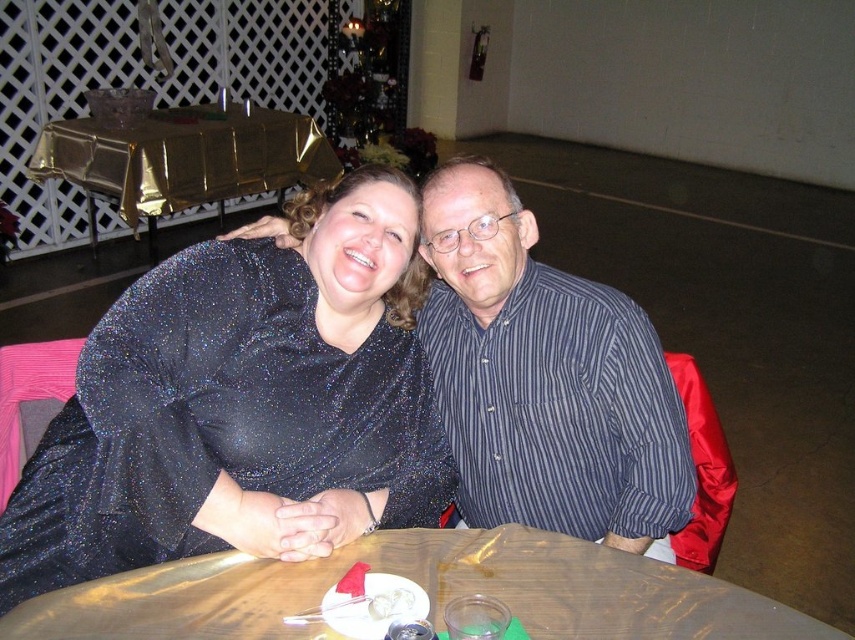
Question: Is gold plastic table at center behind white creamy dessert at table?

Choices:
 (A) yes
 (B) no

Answer: (B)

Question: Which is nearer to the white creamy dessert at table?

Choices:
 (A) gold foil table at upper left
 (B) sparkly black dress at center
 (C) gold plastic table at center
 (D) striped cotton shirt at center

Answer: (C)

Question: Is striped cotton shirt at center below gold plastic table at center?

Choices:
 (A) yes
 (B) no

Answer: (B)

Question: Does sparkly black dress at center appear under white creamy dessert at table?

Choices:
 (A) no
 (B) yes

Answer: (A)

Question: Considering the real-world distances, which object is farthest from the gold foil table at upper left?

Choices:
 (A) gold plastic table at center
 (B) white creamy dessert at table
 (C) striped cotton shirt at center
 (D) sparkly black dress at center

Answer: (B)

Question: Which point appears farthest from the camera in this image?

Choices:
 (A) (612, 472)
 (B) (376, 596)
 (C) (10, 614)
 (D) (323, 403)

Answer: (A)